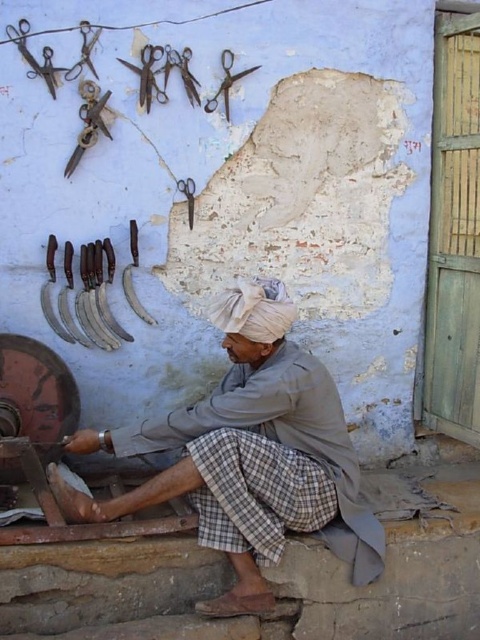
You are an apprentice learning to arrange tools on a wall. You need to place the rusty metal scissors at upper left and the antique brass scissors at upper left in a specific order. According to the wall layout, which scissors should be placed on the left side?

The rusty metal scissors at upper left should be placed on the left side because it is positioned to the left of the antique brass scissors at upper left.

You are standing in front of the weathered light blue wall with patches of exposed white plaster and peeling paint. You see a point at coordinates (84,296). What object is located at this point?

The point at coordinates (84,296) corresponds to the dark brown leather sickles at center.